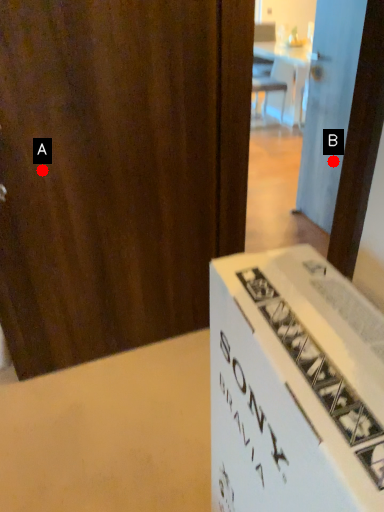
Question: Two points are circled on the image, labeled by A and B beside each circle. Which point is closer to the camera taking this photo?

Choices:
 (A) A is closer
 (B) B is closer

Answer: (A)